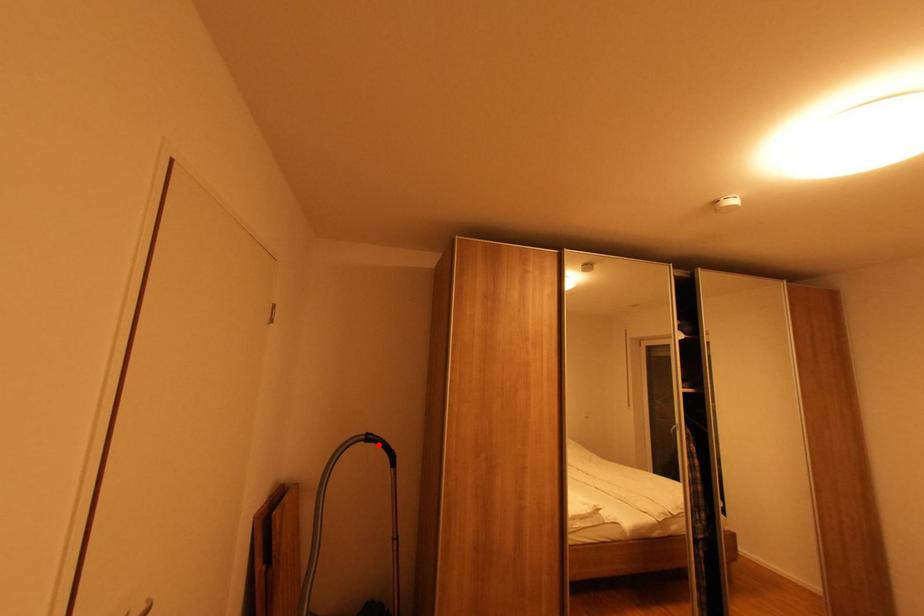
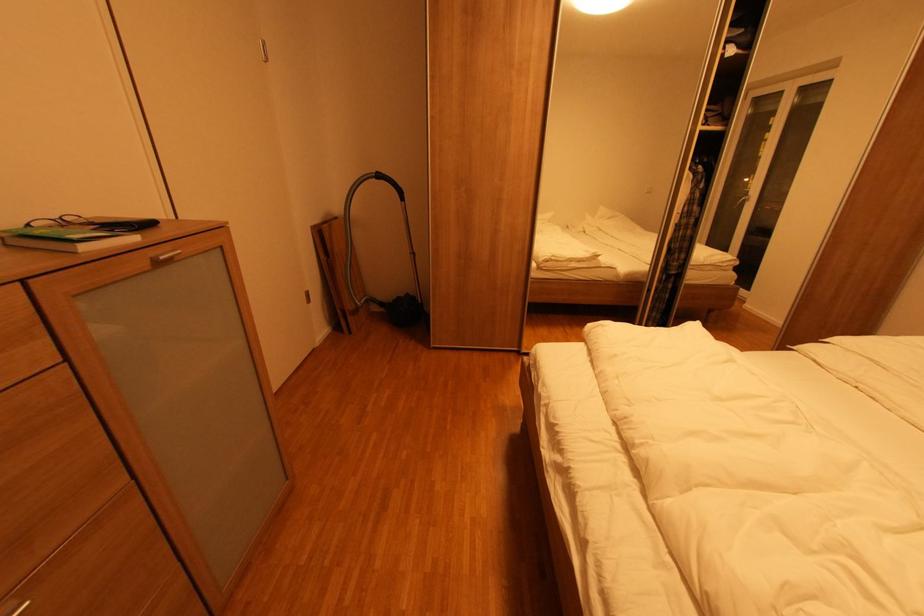
The point at the highlighted location is marked in the first image. Where is the corresponding point in the second image?

(387, 182)